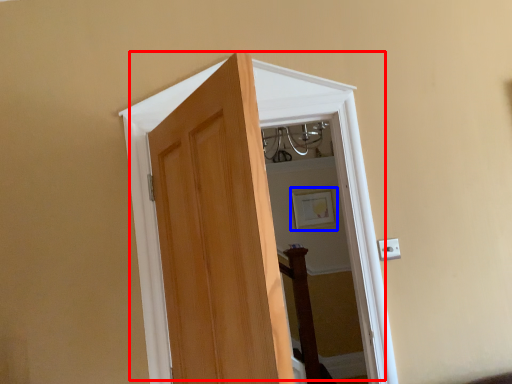
Question: Which point is further to the camera, door (highlighted by a red box) or picture frame (highlighted by a blue box)?

Choices:
 (A) door
 (B) picture frame

Answer: (B)